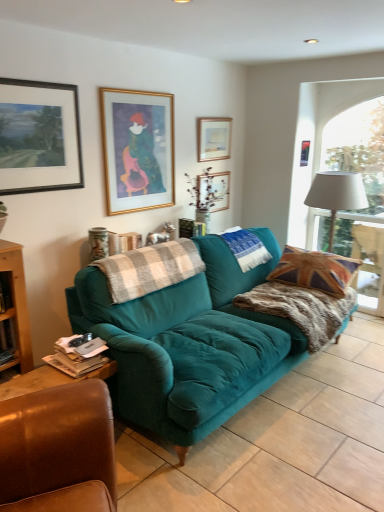
The image size is (384, 512). Describe the element at coordinates (39, 137) in the screenshot. I see `matte black picture frame at upper left, acting as the 1th picture frame starting from the left` at that location.

Find the location of `teal velvet sofa at center`. teal velvet sofa at center is located at coordinates (189, 343).

What do you see at coordinates (213, 138) in the screenshot?
I see `gold-framed picture at upper center, which is counted as the fourth picture frame, starting from the left` at bounding box center [213, 138].

The width and height of the screenshot is (384, 512). I want to click on teal velvet sofa at center, so click(279, 443).

In order to click on matte white picture frame at upper center, which is counted as the 3th picture frame, starting from the right in this screenshot , I will do `click(213, 191)`.

The width and height of the screenshot is (384, 512). Describe the element at coordinates (304, 153) in the screenshot. I see `gold-framed picture at upper center, which ranks as the first picture frame in right-to-left order` at that location.

Locate an element on the screen. matte black picture frame at upper left, the 5th picture frame in the right-to-left sequence is located at coordinates (39, 137).

Is point (348, 116) behind point (241, 477)?

Yes, point (348, 116) is behind point (241, 477).

Which is more to the right, white fabric lampshade at right or teal velvet sofa at center?

Positioned to the right is white fabric lampshade at right.

From a real-world perspective, which is physically above, white fabric lampshade at right or teal velvet sofa at center?

In real-world perspective, white fabric lampshade at right is above.

In the scene shown: How different are the orientations of white fabric lampshade at right and teal velvet sofa at center in degrees?

The angle between the facing direction of white fabric lampshade at right and the facing direction of teal velvet sofa at center is 0.213 degrees.

Does plaid wool blanket at center, the third blanket in the right-to-left sequence, have a lesser height compared to matte black picture frame at upper left, acting as the 1th picture frame starting from the left?

Yes.

From the image's perspective, is plaid wool blanket at center, the third blanket in the right-to-left sequence, positioned above or below matte black picture frame at upper left, acting as the 1th picture frame starting from the left?

plaid wool blanket at center, the third blanket in the right-to-left sequence, is situated lower than matte black picture frame at upper left, acting as the 1th picture frame starting from the left, in the image.

Is plaid wool blanket at center, the third blanket in the right-to-left sequence, not inside matte black picture frame at upper left, the 5th picture frame in the right-to-left sequence?

plaid wool blanket at center, the third blanket in the right-to-left sequence, lies outside matte black picture frame at upper left, the 5th picture frame in the right-to-left sequence,'s area.

From a real-world perspective, is plaid wool blanket at center, the third blanket in the right-to-left sequence, physically below matte black picture frame at upper left, the 5th picture frame in the right-to-left sequence?

Correct, in the physical world, plaid wool blanket at center, the third blanket in the right-to-left sequence, is lower than matte black picture frame at upper left, the 5th picture frame in the right-to-left sequence.

Is union jack fabric pillow at right wider than knitted woolen blanket at center, the 2th blanket when ordered from left to right?

Yes.

From the picture: From a real-world perspective, is union jack fabric pillow at right over knitted woolen blanket at center, the 2th blanket when ordered from left to right?

No, from a real-world perspective, union jack fabric pillow at right is not on top of knitted woolen blanket at center, the 2th blanket when ordered from left to right.

Which of these two, union jack fabric pillow at right or knitted woolen blanket at center, the 2th blanket when ordered from left to right, stands taller?

With more height is union jack fabric pillow at right.

Is white fabric lampshade at right directly adjacent to gold-framed picture at upper center, the 5th picture frame positioned from the left?

white fabric lampshade at right and gold-framed picture at upper center, the 5th picture frame positioned from the left, are clearly separated.

Between point (309, 190) and point (301, 161), which one is positioned behind?

The point (301, 161) is behind.

This screenshot has height=512, width=384. I want to click on lamp on the right of gold-framed picture at upper center, which ranks as the first picture frame in right-to-left order, so click(x=336, y=194).

Is teal velvet sofa at center oriented away from gold-framed picture at upper center, arranged as the 2th picture frame when viewed from the left?

That's not correct — teal velvet sofa at center is not looking away from gold-framed picture at upper center, arranged as the 2th picture frame when viewed from the left.

Are teal velvet sofa at center and gold-framed picture at upper center, arranged as the 2th picture frame when viewed from the left, far apart?

Absolutely, teal velvet sofa at center is distant from gold-framed picture at upper center, arranged as the 2th picture frame when viewed from the left.

Is teal velvet sofa at center shorter than gold-framed picture at upper center, which ranks as the 4th picture frame in right-to-left order?

No, teal velvet sofa at center is not shorter than gold-framed picture at upper center, which ranks as the 4th picture frame in right-to-left order.

Considering the sizes of matte black picture frame at upper left, acting as the 1th picture frame starting from the left, and white fabric lampshade at right in the image, is matte black picture frame at upper left, acting as the 1th picture frame starting from the left, taller or shorter than white fabric lampshade at right?

Considering their sizes, matte black picture frame at upper left, acting as the 1th picture frame starting from the left, has less height than white fabric lampshade at right.

Can you see matte black picture frame at upper left, acting as the 1th picture frame starting from the left, touching white fabric lampshade at right?

No, matte black picture frame at upper left, acting as the 1th picture frame starting from the left, is not next to white fabric lampshade at right.

Considering the relative sizes of matte black picture frame at upper left, the 5th picture frame in the right-to-left sequence, and white fabric lampshade at right in the image provided, is matte black picture frame at upper left, the 5th picture frame in the right-to-left sequence, smaller than white fabric lampshade at right?

Yes.

Can you confirm if matte black picture frame at upper left, acting as the 1th picture frame starting from the left, is positioned to the left of white fabric lampshade at right?

Indeed, matte black picture frame at upper left, acting as the 1th picture frame starting from the left, is positioned on the left side of white fabric lampshade at right.

Does gold-framed picture at upper center, which is counted as the fourth picture frame, starting from the left, have a greater width compared to white fabric lampshade at right?

Incorrect, the width of gold-framed picture at upper center, which is counted as the fourth picture frame, starting from the left, does not surpass that of white fabric lampshade at right.

Does point (219, 158) lie behind point (354, 170)?

No, it is not.

Is gold-framed picture at upper center, which is counted as the fourth picture frame, starting from the left, oriented towards white fabric lampshade at right?

No, gold-framed picture at upper center, which is counted as the fourth picture frame, starting from the left, is not oriented towards white fabric lampshade at right.

Is gold-framed picture at upper center, which is counted as the fourth picture frame, starting from the left, taller or shorter than white fabric lampshade at right?

Clearly, gold-framed picture at upper center, which is counted as the fourth picture frame, starting from the left, is shorter compared to white fabric lampshade at right.

This screenshot has height=512, width=384. I want to click on window positioned vertically above the teal velvet sofa at center (from a real-world perspective), so click(x=366, y=193).

This screenshot has height=512, width=384. What are the coordinates of `the 2nd picture frame counting from the left of the plaid wool blanket at center, the third blanket in the right-to-left sequence` in the screenshot? It's located at (39, 137).

Based on their spatial positions, is teal velvet sofa at center or gold-framed picture at upper center, the 5th picture frame positioned from the left, closer to gold-framed picture at upper center, which ranks as the 4th picture frame in right-to-left order?

Among the two, gold-framed picture at upper center, the 5th picture frame positioned from the left, is located nearer to gold-framed picture at upper center, which ranks as the 4th picture frame in right-to-left order.

Based on the photo, considering their positions, is gold-framed picture at upper center, which ranks as the first picture frame in right-to-left order, positioned further to white fabric lampshade at right than white fabric lampshade at right?

The object further to white fabric lampshade at right is white fabric lampshade at right.

Based on their spatial positions, is gold-framed picture at upper center, acting as the second picture frame starting from the right, or white fabric lampshade at right further from white fabric lampshade at right?

gold-framed picture at upper center, acting as the second picture frame starting from the right, lies further to white fabric lampshade at right than the other object.

Looking at the image, which one is located closer to matte black picture frame at upper left, acting as the 1th picture frame starting from the left, gold-framed picture at upper center, arranged as the 2th picture frame when viewed from the left, or teal velvet sofa at center?

gold-framed picture at upper center, arranged as the 2th picture frame when viewed from the left, is positioned closer to the anchor matte black picture frame at upper left, acting as the 1th picture frame starting from the left.

Which object lies further to the anchor point union jack fabric pillow at right, teal velvet sofa at center or teal velvet sofa at center?

Based on the image, teal velvet sofa at center appears to be further to union jack fabric pillow at right.

In the scene shown: Estimate the real-world distances between objects in this image. Which object is further from fuzzy brown blanket at right, which ranks as the first blanket in right-to-left order, white fabric lampshade at right or gold-framed picture at upper center, acting as the second picture frame starting from the right?

Based on the image, gold-framed picture at upper center, acting as the second picture frame starting from the right, appears to be further to fuzzy brown blanket at right, which ranks as the first blanket in right-to-left order.

Which object lies nearer to the anchor point union jack fabric pillow at right, matte white picture frame at upper center, which is counted as the 3th picture frame, starting from the right, or fuzzy brown blanket at right, arranged as the third blanket when viewed from the left?

Based on the image, fuzzy brown blanket at right, arranged as the third blanket when viewed from the left, appears to be nearer to union jack fabric pillow at right.

Which object lies nearer to the anchor point white fabric lampshade at right, union jack fabric pillow at right or gold-framed picture at upper center, which ranks as the first picture frame in right-to-left order?

gold-framed picture at upper center, which ranks as the first picture frame in right-to-left order, lies closer to white fabric lampshade at right than the other object.

The width and height of the screenshot is (384, 512). Find the location of `throw pillow between teal velvet sofa at center and gold-framed picture at upper center, acting as the second picture frame starting from the right, in the front-back direction`. throw pillow between teal velvet sofa at center and gold-framed picture at upper center, acting as the second picture frame starting from the right, in the front-back direction is located at coordinates (315, 270).

The image size is (384, 512). What are the coordinates of `picture frame positioned between gold-framed picture at upper center, which ranks as the 4th picture frame in right-to-left order, and matte white picture frame at upper center, which is counted as the 3th picture frame, starting from the right, from near to far` in the screenshot? It's located at (213, 138).

Where is `throw pillow located between teal velvet sofa at center and knitted woolen blanket at center, which appears as the 2th blanket when viewed from the right, in the depth direction`? The width and height of the screenshot is (384, 512). throw pillow located between teal velvet sofa at center and knitted woolen blanket at center, which appears as the 2th blanket when viewed from the right, in the depth direction is located at coordinates (315, 270).

This screenshot has width=384, height=512. I want to click on throw pillow located between teal velvet sofa at center and white fabric lampshade at right in the depth direction, so click(x=315, y=270).